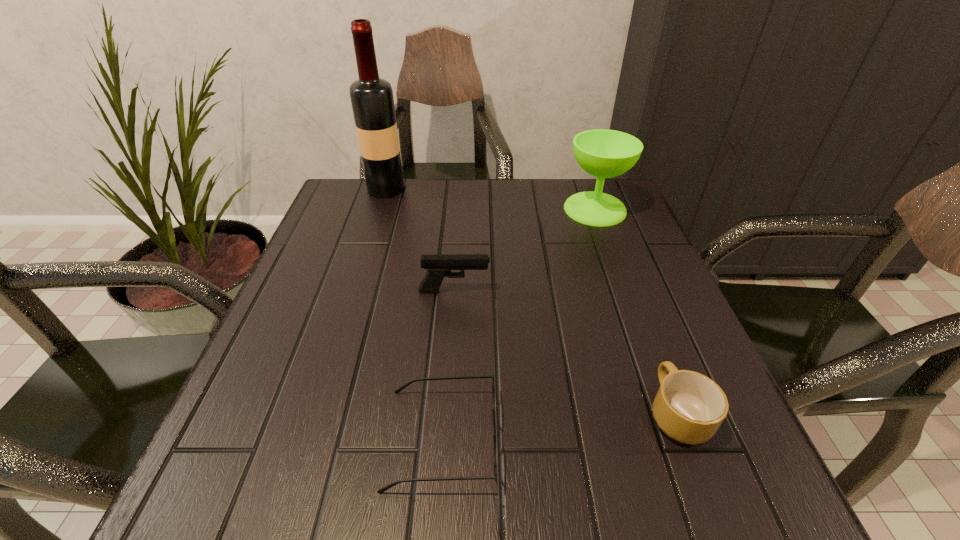
Find the location of a particular element. wine bottle is located at coordinates (372, 101).

In order to click on the tallest object in this screenshot , I will do `click(372, 101)`.

Identify the location of wineglass. pyautogui.click(x=603, y=153).

I want to click on the third shortest object, so click(x=438, y=266).

Locate an element on the screen. pistol is located at coordinates (438, 266).

Find the location of a particular element. the second shortest object is located at coordinates (689, 407).

The height and width of the screenshot is (540, 960). I want to click on spectacles, so click(x=401, y=388).

What are the coordinates of `vacant position located 0.390m on the front of the leftmost object` in the screenshot? It's located at (351, 299).

I want to click on blank space located on the left of the second tallest object, so click(495, 209).

Find the location of a particular element. vacant position located on the front-facing side of the pistol is located at coordinates (581, 291).